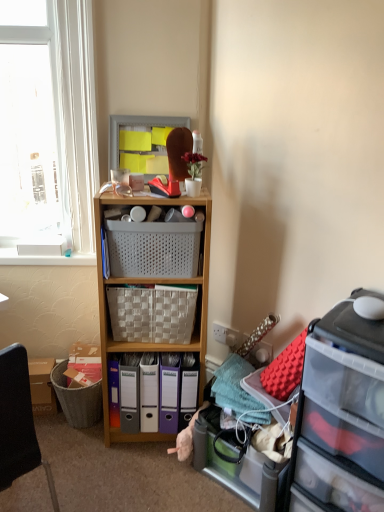
What are the coordinates of `empty space that is ontop of white plastic window sill at upper left (from a real-world perspective)` in the screenshot? It's located at (38, 251).